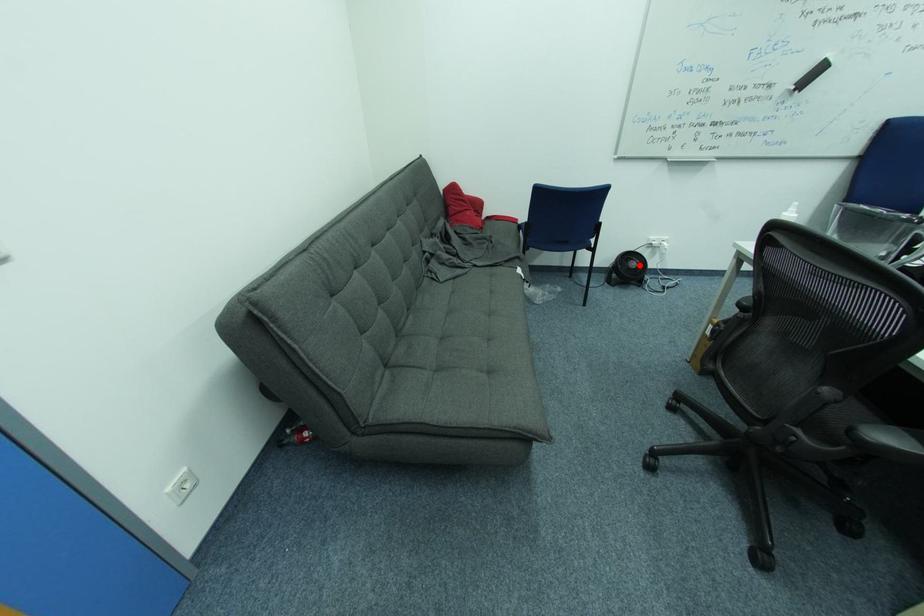
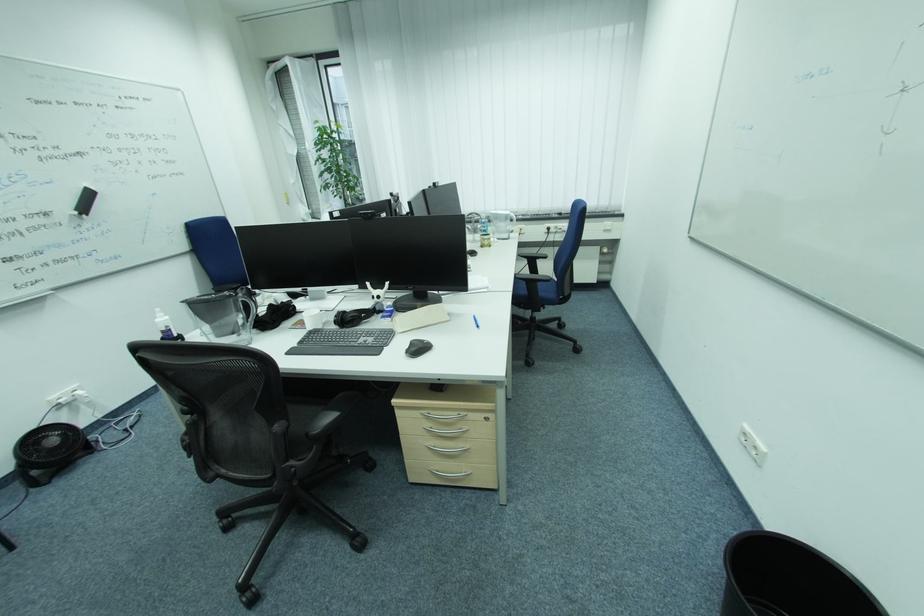
Question: I am providing you with two images of the same scene from different viewpoints. Image1 has a red point marked. In image2, the corresponding 3D location appears at what relative position? Reply with the corresponding letter.

Choices:
 (A) Closer
 (B) Farther

Answer: (B)